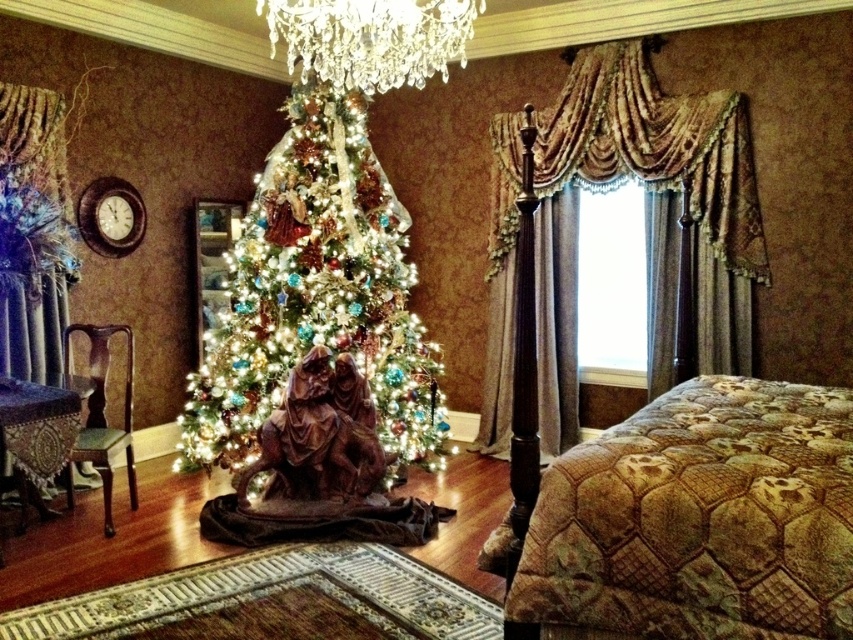
Between point (538, 579) and point (416, 83), which one is positioned in front?

Point (538, 579)

Can you confirm if brown quilted bed at right is bigger than crystal clear chandelier at upper center?

Yes.

Identify the location of brown quilted bed at right. (699, 518).

Locate an element on the screen. The height and width of the screenshot is (640, 853). brown quilted bed at right is located at coordinates (699, 518).

Who is positioned more to the right, iridescent glass christmas tree at center or crystal clear chandelier at upper center?

crystal clear chandelier at upper center

The image size is (853, 640). Identify the location of iridescent glass christmas tree at center. (316, 294).

Who is taller, iridescent glass christmas tree at center or gold quilted bed at right?

iridescent glass christmas tree at center

From the picture: Does iridescent glass christmas tree at center appear on the right side of gold quilted bed at right?

In fact, iridescent glass christmas tree at center is to the left of gold quilted bed at right.

What do you see at coordinates (316, 294) in the screenshot?
I see `iridescent glass christmas tree at center` at bounding box center [316, 294].

Locate an element on the screen. This screenshot has height=640, width=853. iridescent glass christmas tree at center is located at coordinates (316, 294).